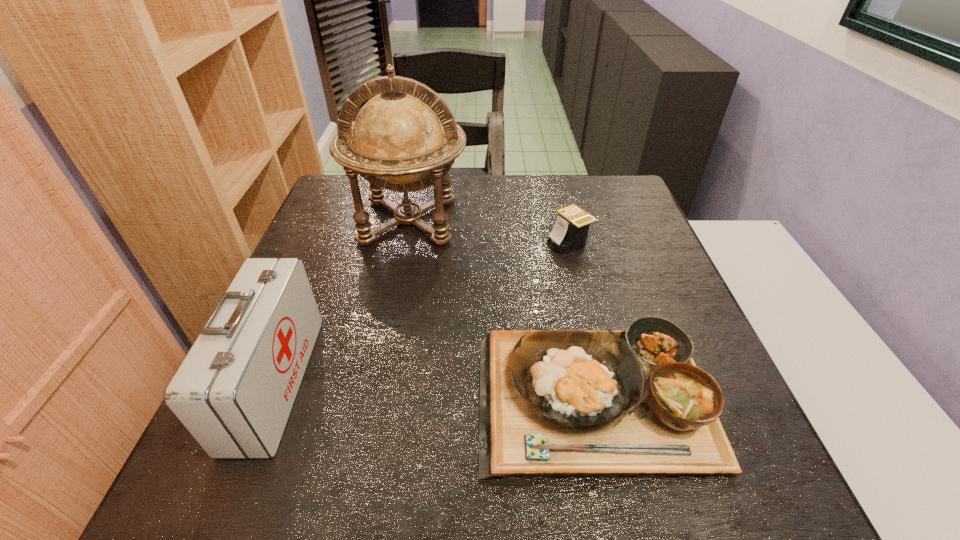
Image resolution: width=960 pixels, height=540 pixels. I want to click on free location that satisfies the following two spatial constraints: 1. on the front-facing side of the platter; 2. on the left side of the first-aid kit, so click(269, 397).

Where is `vacant space that satisfies the following two spatial constraints: 1. on the front-facing side of the calculator; 2. on the right side of the tallest object`? The width and height of the screenshot is (960, 540). vacant space that satisfies the following two spatial constraints: 1. on the front-facing side of the calculator; 2. on the right side of the tallest object is located at coordinates (404, 242).